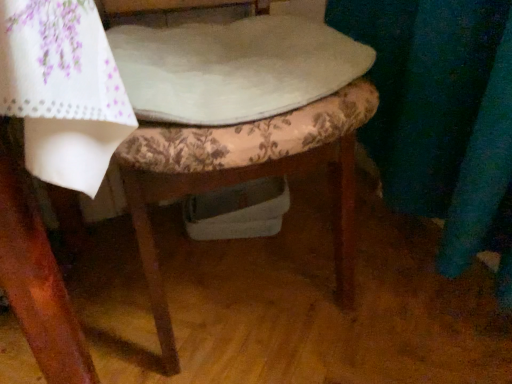
Question: Considering the relative sizes of floral fabric cushion at center and white fabric at center in the image provided, is floral fabric cushion at center smaller than white fabric at center?

Choices:
 (A) yes
 (B) no

Answer: (B)

Question: Does floral fabric cushion at center have a greater height compared to white fabric at center?

Choices:
 (A) yes
 (B) no

Answer: (A)

Question: Is white fabric at center inside floral fabric cushion at center?

Choices:
 (A) yes
 (B) no

Answer: (A)

Question: From the image's perspective, is floral fabric cushion at center beneath white fabric at center?

Choices:
 (A) no
 (B) yes

Answer: (B)

Question: Is floral fabric cushion at center facing towards white fabric at center?

Choices:
 (A) no
 (B) yes

Answer: (B)

Question: Considering the relative sizes of floral fabric cushion at center and white fabric at center in the image provided, is floral fabric cushion at center thinner than white fabric at center?

Choices:
 (A) yes
 (B) no

Answer: (B)

Question: Is white fabric at center looking in the opposite direction of floral fabric cushion at center?

Choices:
 (A) yes
 (B) no

Answer: (A)

Question: From a real-world perspective, is white fabric at center positioned under floral fabric cushion at center based on gravity?

Choices:
 (A) no
 (B) yes

Answer: (A)

Question: Does white fabric at center have a lesser height compared to floral fabric cushion at center?

Choices:
 (A) yes
 (B) no

Answer: (A)

Question: Does white fabric at center appear on the right side of floral fabric cushion at center?

Choices:
 (A) no
 (B) yes

Answer: (B)

Question: Is white fabric at center far away from floral fabric cushion at center?

Choices:
 (A) no
 (B) yes

Answer: (A)

Question: Is floral fabric cushion at center inside white fabric at center?

Choices:
 (A) yes
 (B) no

Answer: (B)

Question: Does point (287, 140) appear closer or farther from the camera than point (193, 124)?

Choices:
 (A) closer
 (B) farther

Answer: (B)